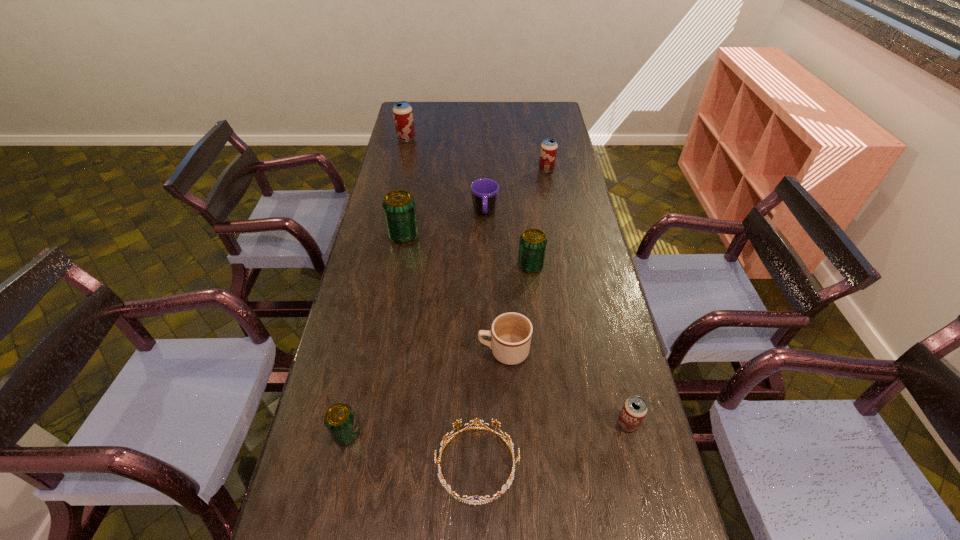
The image size is (960, 540). Find the location of `vacant space at the far right corner`. vacant space at the far right corner is located at coordinates (541, 114).

You are a GUI agent. You are given a task and a screenshot of the screen. Output one action in this format:
    pyautogui.click(x=<x>, y=<y>)
    Task: Click on the vacant area that lies between the rightmost beer can and the tiara
    
    Given the screenshot: What is the action you would take?
    pyautogui.click(x=552, y=444)

Where is `vacant area that lies between the second red beer can from left to right and the farther mug`? The image size is (960, 540). vacant area that lies between the second red beer can from left to right and the farther mug is located at coordinates (516, 191).

Identify the location of free space that is in between the tiara and the fourth nearest beer can. The image size is (960, 540). (441, 349).

This screenshot has height=540, width=960. In order to click on vacant space that's between the farthest beer can and the fourth nearest object in this screenshot , I will do `click(455, 245)`.

Find the location of a particular element. empty space between the third farthest object and the second farthest object is located at coordinates (516, 191).

You are a GUI agent. You are given a task and a screenshot of the screen. Output one action in this format:
    pyautogui.click(x=<x>, y=<y>)
    Task: Click on the vacant point located between the nearest green beer can and the shortest object
    
    Given the screenshot: What is the action you would take?
    pyautogui.click(x=412, y=449)

Locate an element on the screen. The width and height of the screenshot is (960, 540). empty space between the second farthest red beer can and the smallest green beer can is located at coordinates (446, 302).

Find the location of a particular element. This screenshot has height=540, width=960. vacant space in between the biggest red beer can and the rightmost green beer can is located at coordinates (468, 202).

You are a GUI agent. You are given a task and a screenshot of the screen. Output one action in this format:
    pyautogui.click(x=<x>, y=<y>)
    Task: Click on the vacant area that lies between the second beer can from right to left and the farther mug
    Image resolution: width=960 pixels, height=540 pixels.
    Given the screenshot: What is the action you would take?
    pyautogui.click(x=516, y=191)